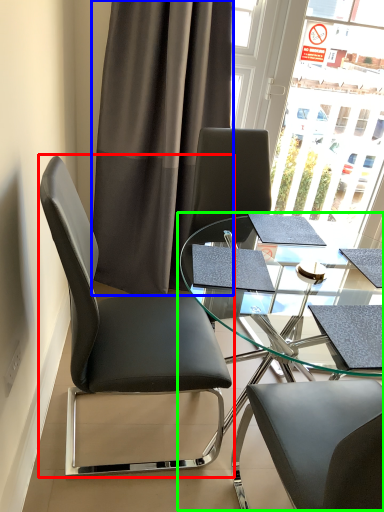
Question: Estimate the real-world distances between objects in this image. Which object is closer to chair (highlighted by a red box), curtain (highlighted by a blue box) or table (highlighted by a green box)?

Choices:
 (A) curtain
 (B) table

Answer: (B)